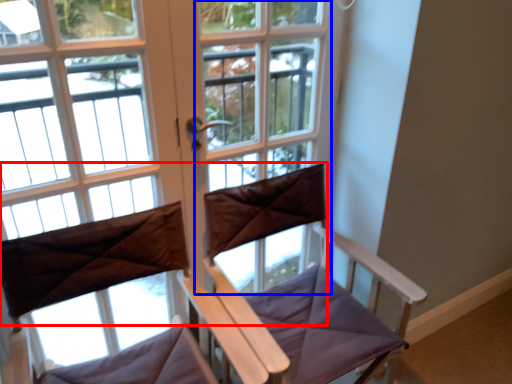
Question: Which object appears farthest to the camera in this image, curtain (highlighted by a red box) or screen door (highlighted by a blue box)?

Choices:
 (A) curtain
 (B) screen door

Answer: (B)